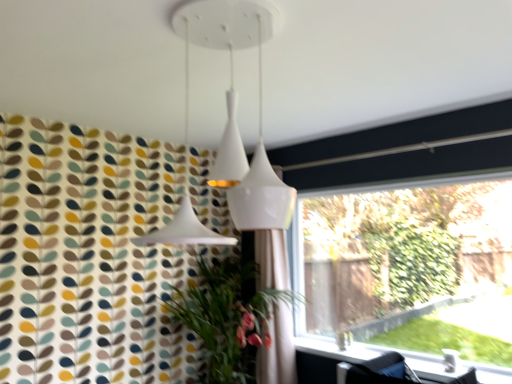
Question: Based on their sizes in the image, would you say white fabric shower curtain at center is bigger or smaller than green leafy plant at lower left?

Choices:
 (A) small
 (B) big

Answer: (A)

Question: From the image's perspective, is white fabric shower curtain at center above or below green leafy plant at lower left?

Choices:
 (A) above
 (B) below

Answer: (A)

Question: Which is farther from the white glossy window sill at lower right?

Choices:
 (A) transparent glass window at right
 (B) white fabric shower curtain at center
 (C) green leafy plant at lower left

Answer: (A)

Question: Estimate the real-world distances between objects in this image. Which object is closer to the transparent glass window at right?

Choices:
 (A) white fabric shower curtain at center
 (B) green leafy plant at lower left
 (C) white glossy window sill at lower right

Answer: (C)